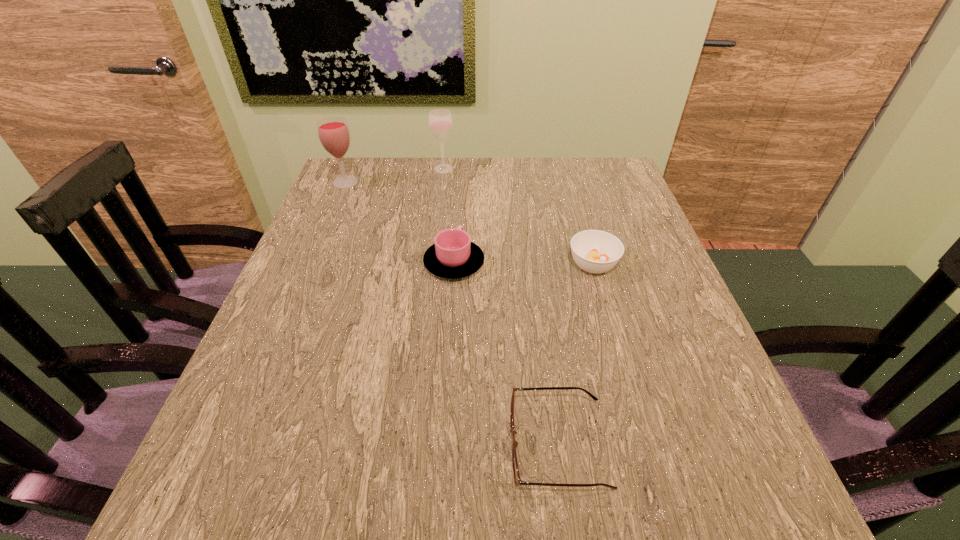
This screenshot has width=960, height=540. What are the coordinates of `free region located 0.200m on the front of the farthest object` in the screenshot? It's located at (438, 215).

You are a GUI agent. You are given a task and a screenshot of the screen. Output one action in this format:
    pyautogui.click(x=<x>, y=<y>)
    Task: Click on the blank space located on the side with the handle of the third shortest object
    The width and height of the screenshot is (960, 540).
    Given the screenshot: What is the action you would take?
    pyautogui.click(x=460, y=177)

Locate an element on the screen. This screenshot has width=960, height=540. vacant space situated 0.320m on the side with the handle of the third shortest object is located at coordinates (460, 174).

Find the location of a particular element. Image resolution: width=960 pixels, height=540 pixels. free space located 0.350m on the side with the handle of the third shortest object is located at coordinates click(460, 169).

Find the location of a particular element. This screenshot has height=540, width=960. free space located on the back of the fourth tallest object is located at coordinates (567, 176).

I want to click on free region located on the lenses of the fourth object from left to right, so click(x=478, y=445).

Locate an element on the screen. The width and height of the screenshot is (960, 540). free space located 0.100m on the lenses of the fourth object from left to right is located at coordinates (445, 445).

You are a GUI agent. You are given a task and a screenshot of the screen. Output one action in this format:
    pyautogui.click(x=<x>, y=<y>)
    Task: Click on the free spot located 0.110m on the lenses of the fourth object from left to right
    
    Given the screenshot: What is the action you would take?
    pyautogui.click(x=440, y=445)

Identify the location of object that is at the near edge. Image resolution: width=960 pixels, height=540 pixels. (x=517, y=479).

Identify the location of object that is positioned at the left edge. Image resolution: width=960 pixels, height=540 pixels. (333, 132).